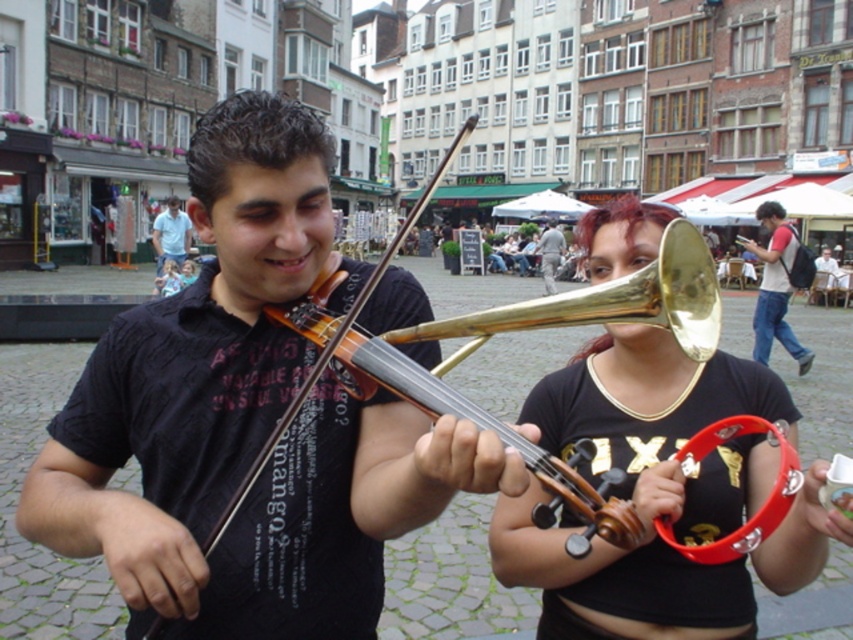
Does white cotton t-shirt at upper right come behind light gray fabric jacket at center?

No, it is not.

Who is lower down, white cotton t-shirt at upper right or light gray fabric jacket at center?

white cotton t-shirt at upper right is lower down.

The height and width of the screenshot is (640, 853). What do you see at coordinates (776, 284) in the screenshot?
I see `white cotton t-shirt at upper right` at bounding box center [776, 284].

The image size is (853, 640). I want to click on white cotton t-shirt at upper right, so click(x=776, y=284).

What do you see at coordinates (776, 284) in the screenshot? The height and width of the screenshot is (640, 853). I see `white cotton t-shirt at upper right` at bounding box center [776, 284].

Is white cotton t-shirt at upper right to the right of light blue shirt at center from the viewer's perspective?

Correct, you'll find white cotton t-shirt at upper right to the right of light blue shirt at center.

Between point (788, 268) and point (160, 228), which one is positioned behind?

The point (160, 228) is behind.

I want to click on white cotton t-shirt at upper right, so click(x=776, y=284).

Is white plastic cup at lower right bigger than light gray fabric jacket at center?

No, white plastic cup at lower right is not bigger than light gray fabric jacket at center.

The width and height of the screenshot is (853, 640). What are the coordinates of `white plastic cup at lower right` in the screenshot? It's located at (828, 278).